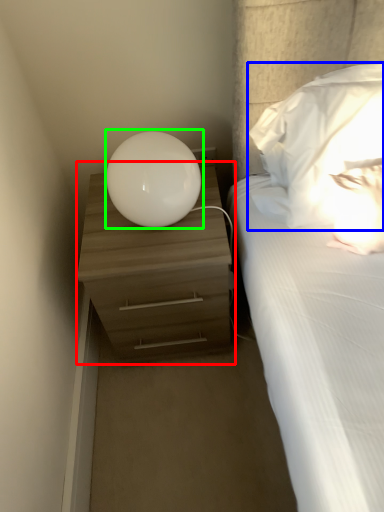
Question: Which object is the farthest from nightstand (highlighted by a red box)? Choose among these: pillow (highlighted by a blue box) or table lamp (highlighted by a green box).

Choices:
 (A) pillow
 (B) table lamp

Answer: (A)